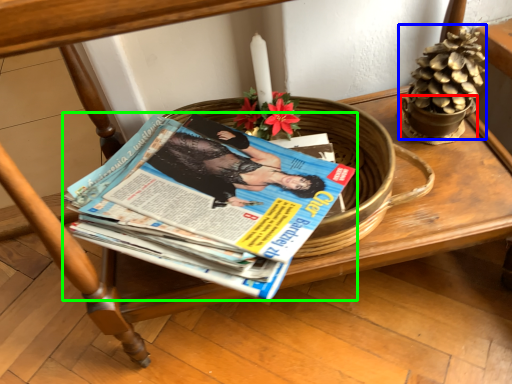
Question: Which is farther away from flowerpot (highlighted by a red box)? flower basket (highlighted by a blue box) or book (highlighted by a green box)?

Choices:
 (A) flower basket
 (B) book

Answer: (B)